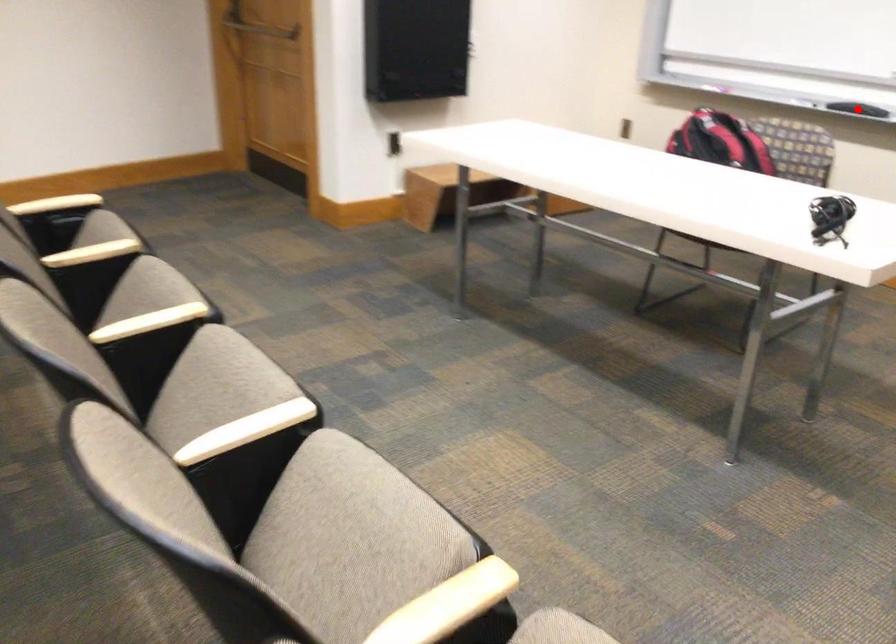
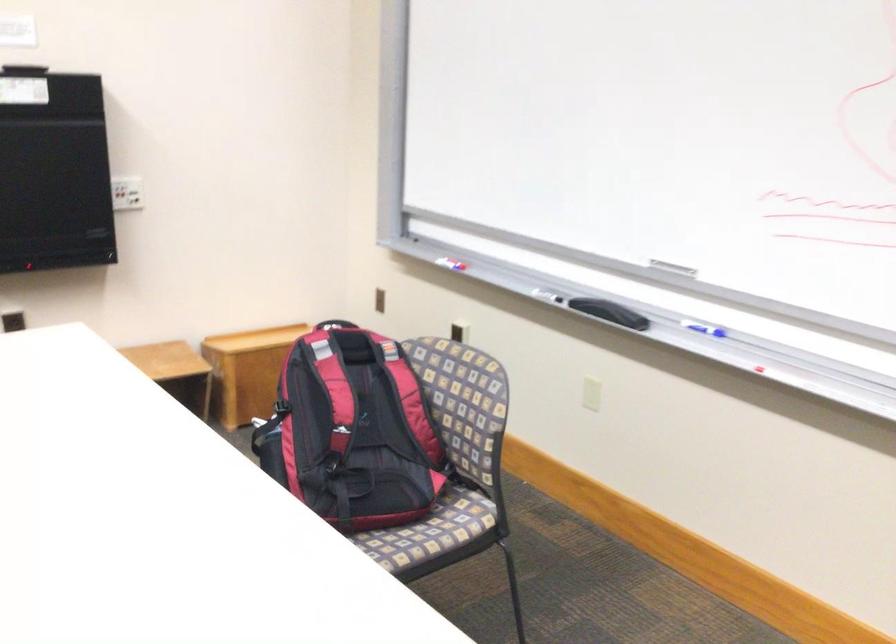
Question: I am providing you with two images of the same scene from different viewpoints. A red point is marked on the first image. Can you still see the location of the red point in image 2?

Choices:
 (A) Yes
 (B) No

Answer: (B)